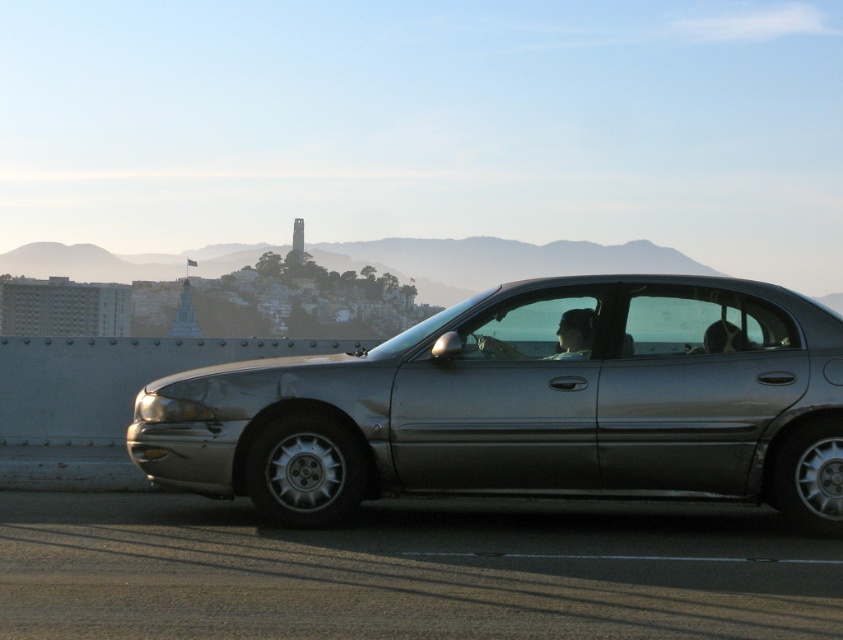
You are a passenger in the satin silver sedan at center. You want to look at the smooth skin face at center sitting next to you. Which direction should you turn your head?

The satin silver sedan at center is to the left of smooth skin face at center, so you should turn your head to your right to look at the smooth skin face at center.

From the picture: You are a photographer trying to capture a clear photo of the smooth skin face at center. However, the satin silver sedan at center is blocking your view. Can you determine if the sedan is between you and the face?

The satin silver sedan at center is positioned under smooth skin face at center, so the sedan is between you and the face, blocking the view.